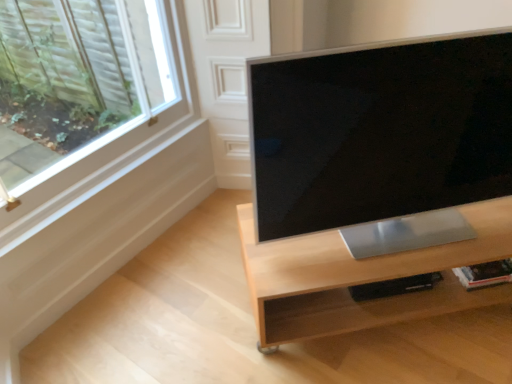
Question: From a real-world perspective, is silver metallic computer monitor at center positioned over light wood/finish tv stand at center based on gravity?

Choices:
 (A) yes
 (B) no

Answer: (A)

Question: Is light wood/finish tv stand at center at the back of silver metallic computer monitor at center?

Choices:
 (A) no
 (B) yes

Answer: (A)

Question: Does silver metallic computer monitor at center have a lesser width compared to light wood/finish tv stand at center?

Choices:
 (A) no
 (B) yes

Answer: (B)

Question: Could light wood/finish tv stand at center be considered to be inside silver metallic computer monitor at center?

Choices:
 (A) yes
 (B) no

Answer: (B)

Question: Does silver metallic computer monitor at center have a lesser height compared to light wood/finish tv stand at center?

Choices:
 (A) yes
 (B) no

Answer: (B)

Question: Is silver metallic computer monitor at center smaller than light wood/finish tv stand at center?

Choices:
 (A) yes
 (B) no

Answer: (A)

Question: Considering the relative sizes of light wood/finish tv stand at center and silver metallic computer monitor at center in the image provided, is light wood/finish tv stand at center shorter than silver metallic computer monitor at center?

Choices:
 (A) yes
 (B) no

Answer: (A)

Question: Can you confirm if light wood/finish tv stand at center is smaller than silver metallic computer monitor at center?

Choices:
 (A) yes
 (B) no

Answer: (B)

Question: From the image's perspective, is light wood/finish tv stand at center on silver metallic computer monitor at center?

Choices:
 (A) no
 (B) yes

Answer: (A)

Question: Does light wood/finish tv stand at center lie behind silver metallic computer monitor at center?

Choices:
 (A) no
 (B) yes

Answer: (B)

Question: From the image's perspective, is light wood/finish tv stand at center under silver metallic computer monitor at center?

Choices:
 (A) yes
 (B) no

Answer: (A)

Question: From a real-world perspective, is light wood/finish tv stand at center over silver metallic computer monitor at center?

Choices:
 (A) no
 (B) yes

Answer: (A)

Question: Is silver metallic computer monitor at center bigger or smaller than light wood/finish tv stand at center?

Choices:
 (A) small
 (B) big

Answer: (A)